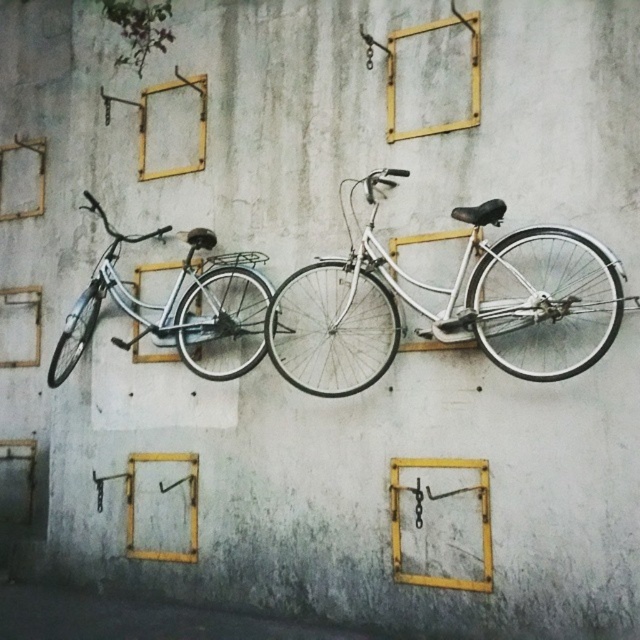
How distant is white metallic bicycle at center from matte white bicycle at left?

A distance of 68.36 centimeters exists between white metallic bicycle at center and matte white bicycle at left.

Is white metallic bicycle at center to the left of matte white bicycle at left from the viewer's perspective?

Incorrect, white metallic bicycle at center is not on the left side of matte white bicycle at left.

Who is more forward, (x=316, y=266) or (x=240, y=317)?

Point (x=316, y=266) is in front.

Identify the location of white metallic bicycle at center. The width and height of the screenshot is (640, 640). (442, 308).